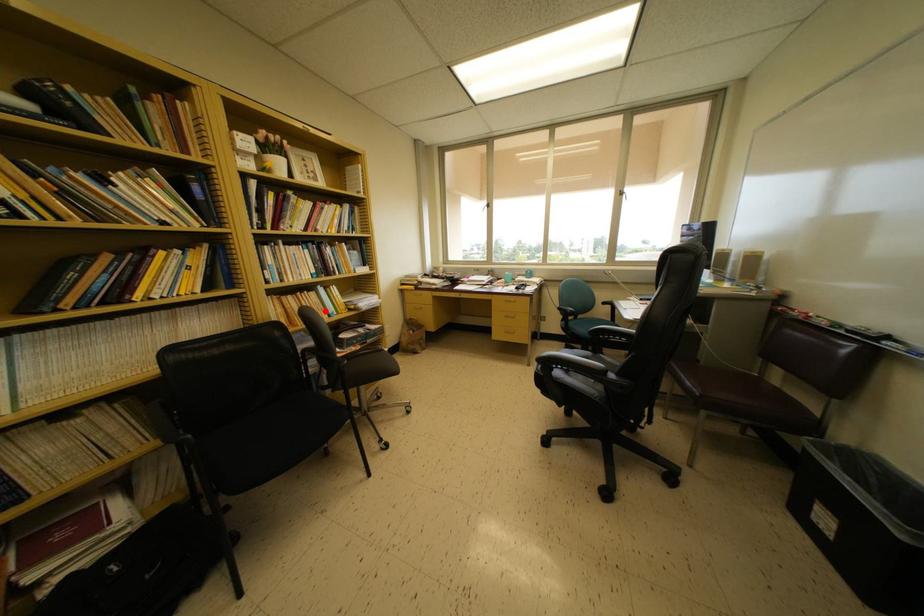
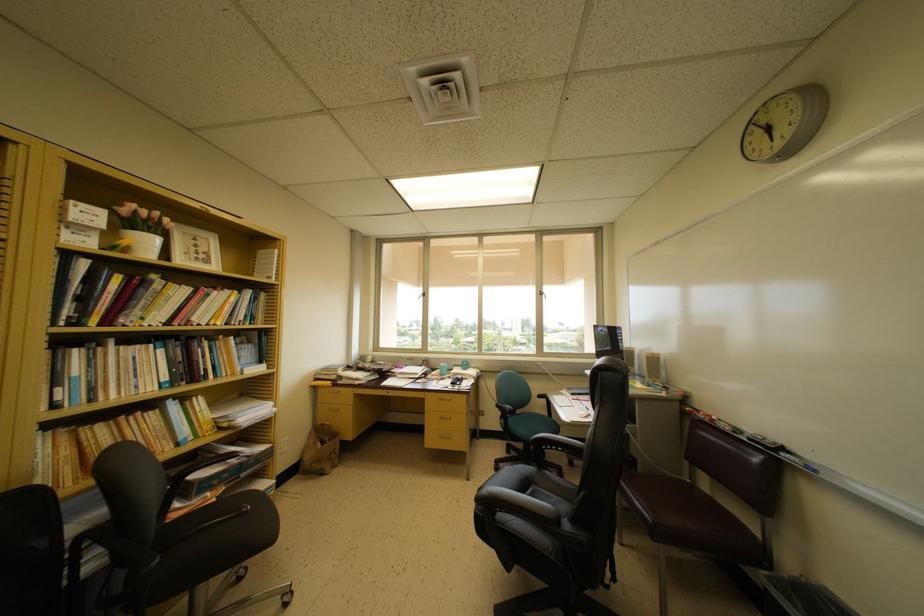
The point at the highlighted location is marked in the first image. Where is the corresponding point in the second image?

(168, 437)